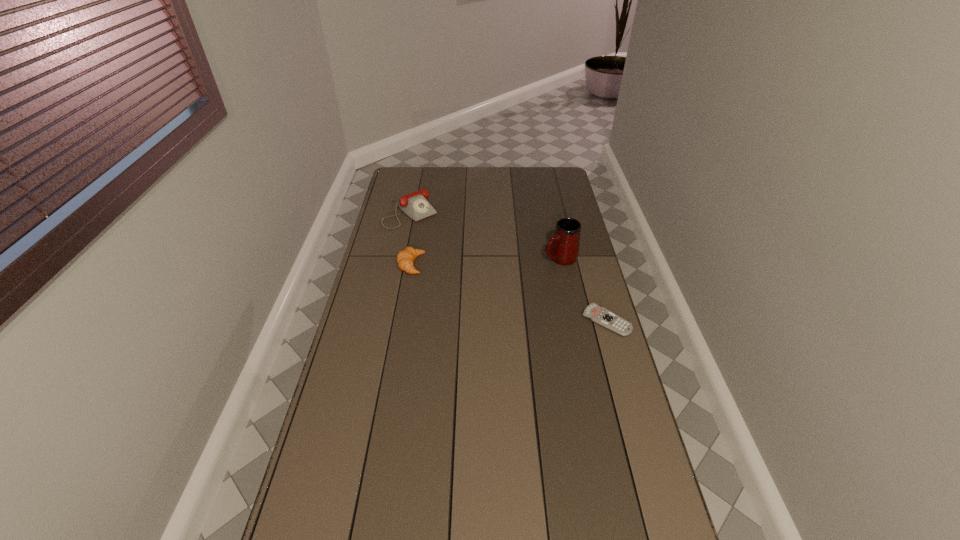
This screenshot has height=540, width=960. I want to click on empty space that is in between the tallest object and the telephone, so click(x=486, y=235).

Where is `free space between the third tallest object and the mug`? free space between the third tallest object and the mug is located at coordinates (486, 261).

You are a GUI agent. You are given a task and a screenshot of the screen. Output one action in this format:
    pyautogui.click(x=<x>, y=<y>)
    Task: Click on the free point between the tallest object and the farthest object
    This screenshot has height=540, width=960.
    Given the screenshot: What is the action you would take?
    pyautogui.click(x=486, y=235)

Find the location of a particular element. This screenshot has width=960, height=540. the second closest object relative to the tallest object is located at coordinates (415, 205).

Locate which object is the closest to the second tallest object. Please provide its 2D coordinates. Your answer should be formatted as a tuple, i.e. [(x, y)], where the tuple contains the x and y coordinates of a point satisfying the conditions above.

[(405, 258)]

The image size is (960, 540). Find the location of `free space that satisfies the following two spatial constraints: 1. on the front side of the tallest object; 2. on the left side of the second tallest object`. free space that satisfies the following two spatial constraints: 1. on the front side of the tallest object; 2. on the left side of the second tallest object is located at coordinates (401, 258).

The image size is (960, 540). Identify the location of free location that satisfies the following two spatial constraints: 1. on the front side of the second tallest object; 2. on the right side of the crescent roll. (400, 265).

Where is `free location that satisfies the following two spatial constraints: 1. on the front side of the farthest object; 2. on the left side of the mug`? free location that satisfies the following two spatial constraints: 1. on the front side of the farthest object; 2. on the left side of the mug is located at coordinates (401, 258).

The height and width of the screenshot is (540, 960). In order to click on free spot that satisfies the following two spatial constraints: 1. on the front side of the nearest object; 2. on the right side of the farthest object in this screenshot , I will do `click(388, 321)`.

At what (x,y) coordinates should I click in order to perform the action: click on free space that satisfies the following two spatial constraints: 1. on the front side of the second tallest object; 2. on the right side of the crescent roll. Please return your answer as a coordinate pair (x, y). Looking at the image, I should click on (400, 265).